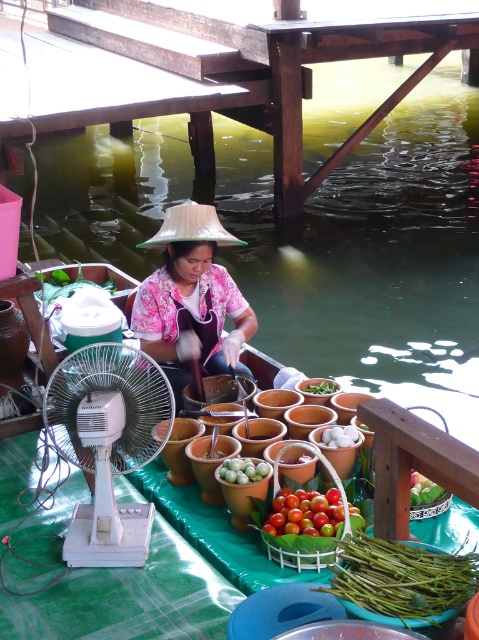
You are a customer at the floating market and want to place an order. You notice the vendor is wearing a pink floral shirt at center and there are green matte string beans at lower center on the table. Can you tell which item is wider from your perspective?

The pink floral shirt at center might be wider than green matte string beans at lower center according to the description.